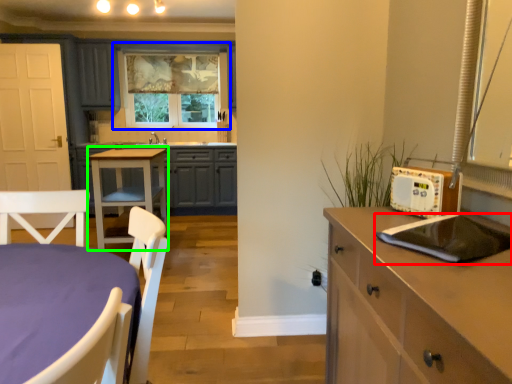
Question: Considering the real-world distances, which object is farthest from kitchen appliance (highlighted by a red box)? window (highlighted by a blue box) or table (highlighted by a green box)?

Choices:
 (A) window
 (B) table

Answer: (A)